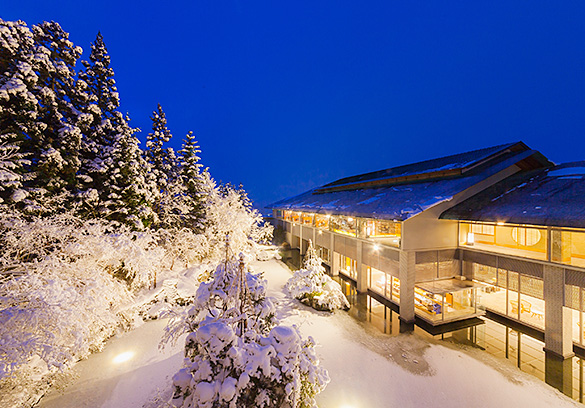
You are a GUI agent. You are given a task and a screenshot of the screen. Output one action in this format:
    pyautogui.click(x=<x>, y=<y>)
    Task: Click on the hotel
    
    Given the screenshot: What is the action you would take?
    pyautogui.click(x=494, y=289)